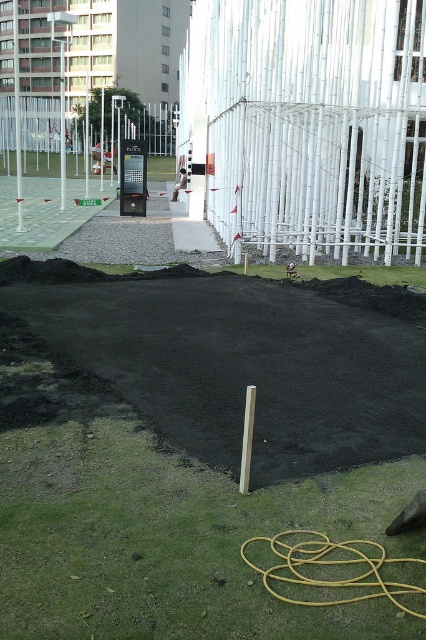
Question: Can you confirm if white bamboo fence at upper center is bigger than white metal fence at upper center?

Choices:
 (A) yes
 (B) no

Answer: (B)

Question: Can you confirm if white bamboo fence at upper center is thinner than white metal fence at upper center?

Choices:
 (A) no
 (B) yes

Answer: (B)

Question: Among these objects, which one is nearest to the camera?

Choices:
 (A) white metal fence at upper center
 (B) white bamboo fence at upper center

Answer: (B)

Question: Does white bamboo fence at upper center appear over white metal fence at upper center?

Choices:
 (A) no
 (B) yes

Answer: (A)

Question: Which of the following is the closest to the observer?

Choices:
 (A) white bamboo fence at upper center
 (B) white metal fence at upper center

Answer: (A)